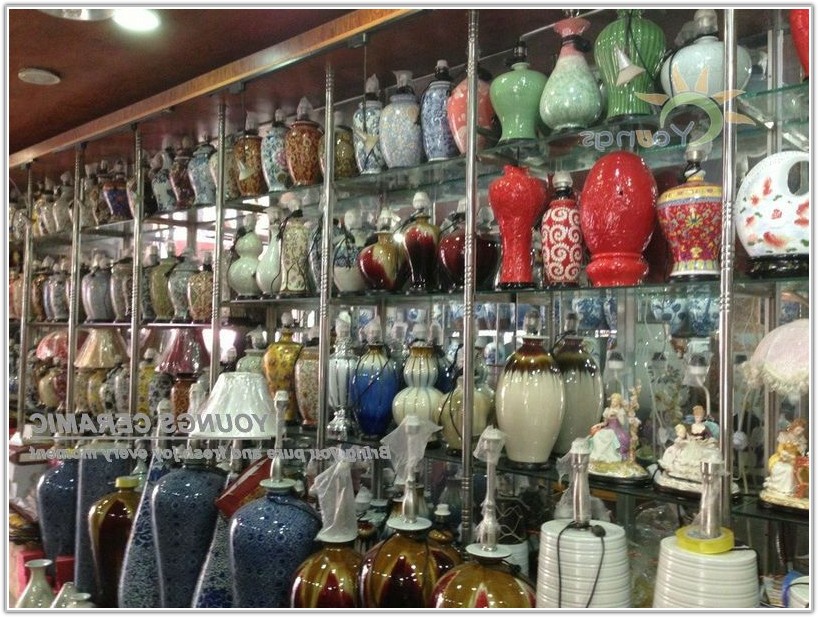
Where is `lamp`? The height and width of the screenshot is (617, 818). lamp is located at coordinates (119, 21).